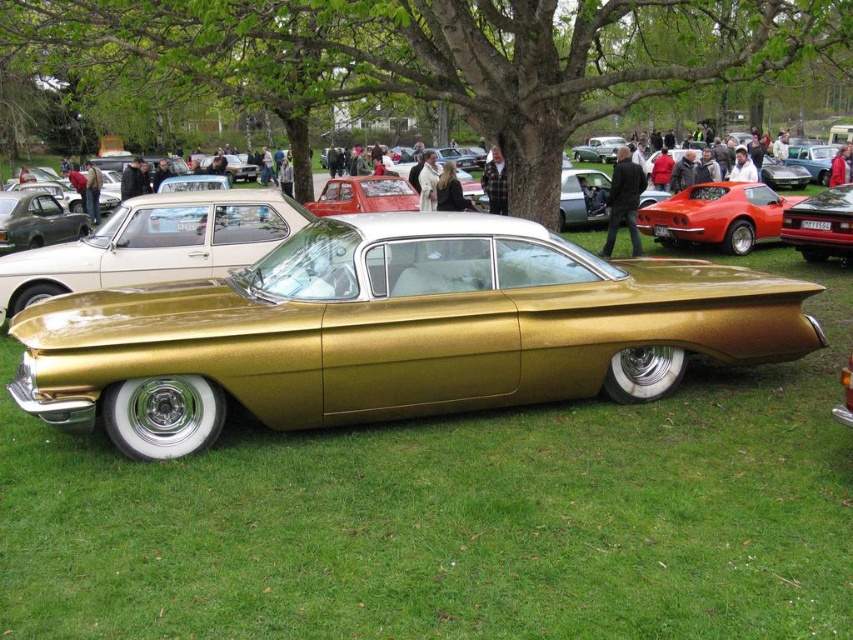
Question: Is gold metallic car at center bigger than shiny red car at center?

Choices:
 (A) yes
 (B) no

Answer: (A)

Question: Is green leafy tree at center thinner than shiny red car at center?

Choices:
 (A) no
 (B) yes

Answer: (A)

Question: Which object appears farthest from the camera in this image?

Choices:
 (A) gold metallic car at center
 (B) green leafy tree at center

Answer: (B)

Question: Which object appears farthest from the camera in this image?

Choices:
 (A) shiny red car at right
 (B) shiny red car at center
 (C) green leafy tree at center
 (D) gold metallic car at center

Answer: (A)

Question: Estimate the real-world distances between objects in this image. Which object is farther from the shiny red car at center?

Choices:
 (A) gold metallic car at center
 (B) shiny red car at right
 (C) green leafy tree at center

Answer: (A)

Question: Can you confirm if green leafy tree at center is positioned to the right of shiny red car at right?

Choices:
 (A) yes
 (B) no

Answer: (B)